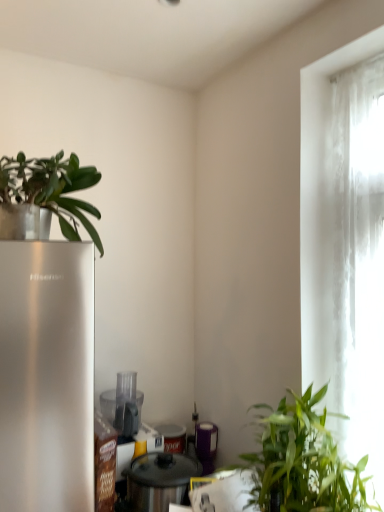
What do you see at coordinates (52, 189) in the screenshot?
I see `green matte plant at upper left, which is the 1th houseplant in top-to-bottom order` at bounding box center [52, 189].

Where is `purple matte canister at center, which appears as the third appliance when viewed from the front`? The height and width of the screenshot is (512, 384). purple matte canister at center, which appears as the third appliance when viewed from the front is located at coordinates (206, 444).

What do you see at coordinates (303, 461) in the screenshot? The width and height of the screenshot is (384, 512). I see `green leafy plant at lower right, arranged as the first houseplant when viewed from the right` at bounding box center [303, 461].

Locate an element on the screen. transparent plastic food processor at center, the 2th appliance positioned from the front is located at coordinates (123, 404).

Is green matte plant at upper left, which is the 1th houseplant in top-to-bottom order, oriented towards green leafy plant at lower right, which is the first houseplant from bottom to top?

No, green matte plant at upper left, which is the 1th houseplant in top-to-bottom order, is not turned towards green leafy plant at lower right, which is the first houseplant from bottom to top.

Would you say green matte plant at upper left, the first houseplant positioned from the left, is inside or outside green leafy plant at lower right, positioned as the second houseplant in top-to-bottom order?

green matte plant at upper left, the first houseplant positioned from the left, is not inside green leafy plant at lower right, positioned as the second houseplant in top-to-bottom order, it's outside.

Considering the relative positions of green matte plant at upper left, which is the 1th houseplant in top-to-bottom order, and green leafy plant at lower right, positioned as the second houseplant in top-to-bottom order, in the image provided, is green matte plant at upper left, which is the 1th houseplant in top-to-bottom order, to the right of green leafy plant at lower right, positioned as the second houseplant in top-to-bottom order, from the viewer's perspective?

Incorrect, green matte plant at upper left, which is the 1th houseplant in top-to-bottom order, is not on the right side of green leafy plant at lower right, positioned as the second houseplant in top-to-bottom order.

Based on the photo, does green matte plant at upper left, the first houseplant positioned from the left, have a greater height compared to green leafy plant at lower right, arranged as the first houseplant when viewed from the right?

No, green matte plant at upper left, the first houseplant positioned from the left, is not taller than green leafy plant at lower right, arranged as the first houseplant when viewed from the right.

Is purple matte canister at center, positioned as the first appliance in back-to-front order, spatially inside metallic silver pot at center, the first appliance positioned from the front, or outside of it?

purple matte canister at center, positioned as the first appliance in back-to-front order, is not inside metallic silver pot at center, the first appliance positioned from the front, it's outside.

Is purple matte canister at center, which appears as the third appliance when viewed from the front, placed right next to metallic silver pot at center, the first appliance positioned from the front?

purple matte canister at center, which appears as the third appliance when viewed from the front, and metallic silver pot at center, the first appliance positioned from the front, are not in contact.

Which is in front, point (214, 433) or point (130, 496)?

Positioned in front is point (130, 496).

Looking at this image, between purple matte canister at center, positioned as the first appliance in back-to-front order, and metallic silver pot at center, the first appliance positioned from the front, which one has smaller width?

With smaller width is purple matte canister at center, positioned as the first appliance in back-to-front order.

From the image's perspective, relative to green leafy plant at lower right, acting as the second houseplant starting from the left, is metallic silver pot at center, the third appliance in the back-to-front sequence, above or below?

metallic silver pot at center, the third appliance in the back-to-front sequence, is situated lower than green leafy plant at lower right, acting as the second houseplant starting from the left, in the image.

Based on the photo, from a real-world perspective, who is located lower, metallic silver pot at center, the third appliance in the back-to-front sequence, or green leafy plant at lower right, positioned as the second houseplant in top-to-bottom order?

From a 3D spatial view, metallic silver pot at center, the third appliance in the back-to-front sequence, is below.

Would you consider metallic silver pot at center, the third appliance in the back-to-front sequence, to be distant from green leafy plant at lower right, acting as the second houseplant starting from the left?

No, metallic silver pot at center, the third appliance in the back-to-front sequence, is not far from green leafy plant at lower right, acting as the second houseplant starting from the left.

Which object is positioned more to the right, metallic silver pot at center, the first appliance positioned from the front, or green leafy plant at lower right, positioned as the second houseplant in top-to-bottom order?

green leafy plant at lower right, positioned as the second houseplant in top-to-bottom order.

Is green matte plant at upper left, the 2th houseplant when ordered from bottom to top, far away from transparent plastic food processor at center, marked as the second appliance in a back-to-front arrangement?

No, there isn't a large distance between green matte plant at upper left, the 2th houseplant when ordered from bottom to top, and transparent plastic food processor at center, marked as the second appliance in a back-to-front arrangement.

Would you say green matte plant at upper left, the first houseplant positioned from the left, is inside or outside transparent plastic food processor at center, the 2th appliance positioned from the front?

green matte plant at upper left, the first houseplant positioned from the left, cannot be found inside transparent plastic food processor at center, the 2th appliance positioned from the front.

From the picture: From a real-world perspective, is green matte plant at upper left, the first houseplant positioned from the left, located beneath transparent plastic food processor at center, the 2th appliance positioned from the front?

Incorrect, from a real-world perspective, green matte plant at upper left, the first houseplant positioned from the left, is higher than transparent plastic food processor at center, the 2th appliance positioned from the front.

Is point (25, 179) positioned before point (135, 384)?

Yes, point (25, 179) is closer to viewer.

Image resolution: width=384 pixels, height=512 pixels. I want to click on window lying behind the green leafy plant at lower right, positioned as the second houseplant in top-to-bottom order, so click(x=343, y=245).

Is green leafy plant at lower right, which is the first houseplant from bottom to top, wider than translucent fabric curtain at right?

Indeed, green leafy plant at lower right, which is the first houseplant from bottom to top, has a greater width compared to translucent fabric curtain at right.

Considering the sizes of objects green leafy plant at lower right, which is the first houseplant from bottom to top, and translucent fabric curtain at right in the image provided, who is smaller, green leafy plant at lower right, which is the first houseplant from bottom to top, or translucent fabric curtain at right?

translucent fabric curtain at right is smaller.

Are green leafy plant at lower right, acting as the second houseplant starting from the left, and translucent fabric curtain at right located far from each other?

No, green leafy plant at lower right, acting as the second houseplant starting from the left, is not far away from translucent fabric curtain at right.

Is green leafy plant at lower right, positioned as the second houseplant in top-to-bottom order, not close to transparent plastic food processor at center, the 2th appliance positioned from the front?

No, green leafy plant at lower right, positioned as the second houseplant in top-to-bottom order, is not far away from transparent plastic food processor at center, the 2th appliance positioned from the front.

From the image's perspective, which object appears higher, green leafy plant at lower right, arranged as the first houseplant when viewed from the right, or transparent plastic food processor at center, marked as the second appliance in a back-to-front arrangement?

transparent plastic food processor at center, marked as the second appliance in a back-to-front arrangement, from the image's perspective.

From a real-world perspective, between green leafy plant at lower right, positioned as the second houseplant in top-to-bottom order, and transparent plastic food processor at center, the 2th appliance positioned from the front, who is vertically lower?

green leafy plant at lower right, positioned as the second houseplant in top-to-bottom order, from a real-world perspective.

Identify the location of appliance above the green leafy plant at lower right, which is the first houseplant from bottom to top (from the image's perspective). (123, 404).

Is metallic silver pot at center, the first appliance positioned from the front, far from translucent fabric curtain at right?

Actually, metallic silver pot at center, the first appliance positioned from the front, and translucent fabric curtain at right are a little close together.

Would you say metallic silver pot at center, the first appliance positioned from the front, is inside or outside translucent fabric curtain at right?

metallic silver pot at center, the first appliance positioned from the front, is spatially situated outside translucent fabric curtain at right.

Can you confirm if metallic silver pot at center, the first appliance positioned from the front, is positioned to the right of translucent fabric curtain at right?

Incorrect, metallic silver pot at center, the first appliance positioned from the front, is not on the right side of translucent fabric curtain at right.

I want to click on houseplant below the green matte plant at upper left, which is the 1th houseplant in top-to-bottom order (from a real-world perspective), so click(x=303, y=461).

Locate an element on the screen. appliance that is the 2nd one when counting forward from the purple matte canister at center, positioned as the first appliance in back-to-front order is located at coordinates coord(160,480).

Considering their positions, is purple matte canister at center, which appears as the third appliance when viewed from the front, positioned closer to green matte plant at upper left, the 2th houseplant in the right-to-left sequence, than transparent plastic food processor at center, marked as the second appliance in a back-to-front arrangement?

Among the two, transparent plastic food processor at center, marked as the second appliance in a back-to-front arrangement, is located nearer to green matte plant at upper left, the 2th houseplant in the right-to-left sequence.

From the image, which object appears to be farther from green leafy plant at lower right, which is the first houseplant from bottom to top, translucent fabric curtain at right or purple matte canister at center, positioned as the first appliance in back-to-front order?

A: purple matte canister at center, positioned as the first appliance in back-to-front order, is further to green leafy plant at lower right, which is the first houseplant from bottom to top.

Based on their spatial positions, is purple matte canister at center, which appears as the third appliance when viewed from the front, or transparent plastic food processor at center, the 2th appliance positioned from the front, further from translucent fabric curtain at right?

transparent plastic food processor at center, the 2th appliance positioned from the front, is positioned further to the anchor translucent fabric curtain at right.

Considering their positions, is green matte plant at upper left, the 2th houseplant when ordered from bottom to top, positioned further to transparent plastic food processor at center, the 2th appliance positioned from the front, than metallic silver pot at center, the first appliance positioned from the front?

green matte plant at upper left, the 2th houseplant when ordered from bottom to top, is positioned further to the anchor transparent plastic food processor at center, the 2th appliance positioned from the front.

When comparing their distances from purple matte canister at center, positioned as the first appliance in back-to-front order, does green matte plant at upper left, the 2th houseplant when ordered from bottom to top, or metallic silver pot at center, the first appliance positioned from the front, seem closer?

Among the two, metallic silver pot at center, the first appliance positioned from the front, is located nearer to purple matte canister at center, positioned as the first appliance in back-to-front order.

Looking at the image, which one is located further to green leafy plant at lower right, positioned as the second houseplant in top-to-bottom order, transparent plastic food processor at center, the 2th appliance positioned from the front, or purple matte canister at center, which appears as the third appliance when viewed from the front?

The object further to green leafy plant at lower right, positioned as the second houseplant in top-to-bottom order, is transparent plastic food processor at center, the 2th appliance positioned from the front.

Which object lies nearer to the anchor point green leafy plant at lower right, positioned as the second houseplant in top-to-bottom order, green matte plant at upper left, the 2th houseplant when ordered from bottom to top, or metallic silver pot at center, the third appliance in the back-to-front sequence?

metallic silver pot at center, the third appliance in the back-to-front sequence.

Looking at the image, which one is located closer to green matte plant at upper left, the first houseplant positioned from the left, purple matte canister at center, positioned as the first appliance in back-to-front order, or metallic silver pot at center, the third appliance in the back-to-front sequence?

metallic silver pot at center, the third appliance in the back-to-front sequence.

The height and width of the screenshot is (512, 384). I want to click on houseplant between translucent fabric curtain at right and metallic silver pot at center, the first appliance positioned from the front, from top to bottom, so [303, 461].

I want to click on appliance that lies between green matte plant at upper left, the first houseplant positioned from the left, and purple matte canister at center, positioned as the first appliance in back-to-front order, from top to bottom, so click(123, 404).

You are a GUI agent. You are given a task and a screenshot of the screen. Output one action in this format:
    pyautogui.click(x=<x>, y=<y>)
    Task: Click on the houseplant between transparent plastic food processor at center, marked as the second appliance in a back-to-front arrangement, and translucent fabric curtain at right
    Image resolution: width=384 pixels, height=512 pixels.
    Given the screenshot: What is the action you would take?
    pyautogui.click(x=303, y=461)

Find the location of `houseplant between green matte plant at upper left, which is the 1th houseplant in top-to-bottom order, and purple matte canister at center, which appears as the third appliance when viewed from the front, vertically`. houseplant between green matte plant at upper left, which is the 1th houseplant in top-to-bottom order, and purple matte canister at center, which appears as the third appliance when viewed from the front, vertically is located at coordinates (303, 461).